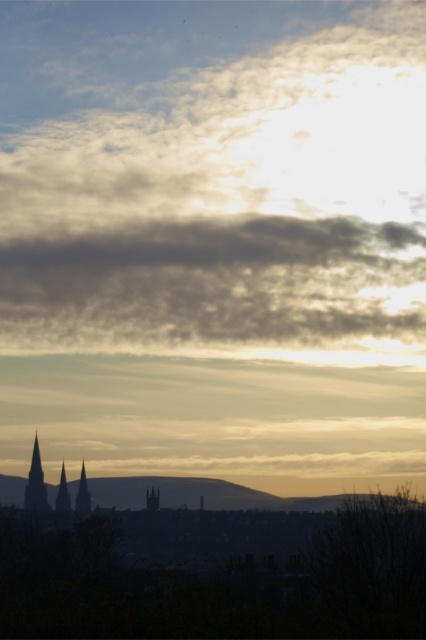
Question: Considering the relative positions of dark gray stone tower at lower left and silvery metallic spire at lower left in the image provided, where is dark gray stone tower at lower left located with respect to silvery metallic spire at lower left?

Choices:
 (A) left
 (B) right

Answer: (A)

Question: Which point is closer to the camera?

Choices:
 (A) click(57, 502)
 (B) click(149, 496)
 (C) click(34, 476)
 (D) click(80, 481)

Answer: (B)

Question: Is smooth stone spire at center thinner than silvery metallic spire at lower left?

Choices:
 (A) yes
 (B) no

Answer: (B)

Question: Which point is closer to the camera taking this photo?

Choices:
 (A) (157, 500)
 (B) (37, 458)

Answer: (A)

Question: Estimate the real-world distances between objects in this image. Which object is farther from the silvery metallic spire at lower left?

Choices:
 (A) dark gray stone spire at lower left
 (B) smooth stone spire at center

Answer: (A)

Question: Is dark gray stone tower at lower left wider than smooth stone spire at center?

Choices:
 (A) no
 (B) yes

Answer: (B)